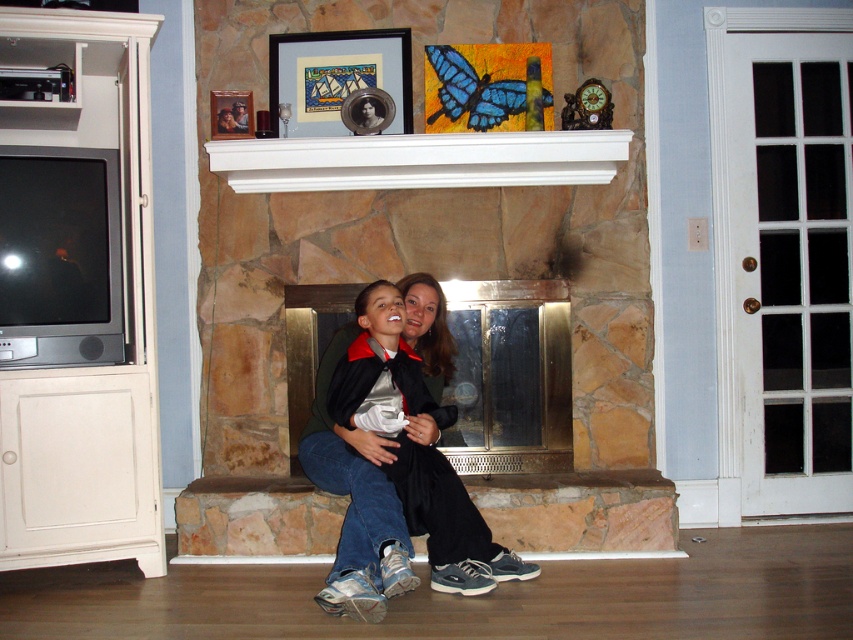
Question: Among these objects, which one is nearest to the camera?

Choices:
 (A) matte black jacket at center
 (B) wooden picture frame at upper center
 (C) white wood mantle at upper center
 (D) matte plastic picture frame at upper center

Answer: (A)

Question: Does matte plastic picture frame at upper center appear over wooden picture frame at upper center?

Choices:
 (A) no
 (B) yes

Answer: (B)

Question: Which object is the closest to the white wood mantle at upper center?

Choices:
 (A) wooden picture frame at upper center
 (B) matte black jacket at center
 (C) stone fireplace at center
 (D) matte plastic picture frame at upper center

Answer: (D)

Question: Does matte black jacket at center have a lesser width compared to white wood mantle at upper center?

Choices:
 (A) yes
 (B) no

Answer: (A)

Question: Can you confirm if stone fireplace at center is positioned above white wood mantle at upper center?

Choices:
 (A) yes
 (B) no

Answer: (B)

Question: Which of these objects is positioned closest to the white wood mantle at upper center?

Choices:
 (A) matte black jacket at center
 (B) matte plastic picture frame at upper center
 (C) stone fireplace at center

Answer: (B)